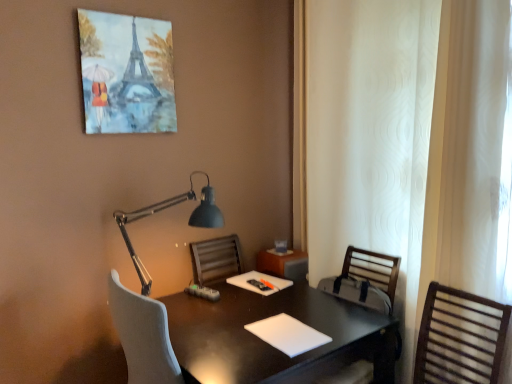
Question: Does black glossy desk at center have a greater height compared to white matte notepad at center, which is the first notepad from bottom to top?

Choices:
 (A) no
 (B) yes

Answer: (B)

Question: Can you confirm if black glossy desk at center is wider than white matte notepad at center, the first notepad positioned from the front?

Choices:
 (A) no
 (B) yes

Answer: (B)

Question: Is black glossy desk at center located outside white matte notepad at center, which is the second notepad in top-to-bottom order?

Choices:
 (A) yes
 (B) no

Answer: (A)

Question: From the image's perspective, is black glossy desk at center located beneath white matte notepad at center, positioned as the 2th notepad in back-to-front order?

Choices:
 (A) no
 (B) yes

Answer: (B)

Question: Does black glossy desk at center have a larger size compared to white matte notepad at center, the first notepad positioned from the front?

Choices:
 (A) no
 (B) yes

Answer: (B)

Question: Relative to white textured curtain at right, is matte black lamp at upper center in front or behind?

Choices:
 (A) behind
 (B) front

Answer: (A)

Question: Considering the relative positions of matte black lamp at upper center and white textured curtain at right in the image provided, is matte black lamp at upper center to the left or to the right of white textured curtain at right?

Choices:
 (A) left
 (B) right

Answer: (A)

Question: From the image's perspective, relative to white textured curtain at right, is matte black lamp at upper center above or below?

Choices:
 (A) below
 (B) above

Answer: (A)

Question: Looking at the image, does matte black lamp at upper center seem bigger or smaller compared to white textured curtain at right?

Choices:
 (A) big
 (B) small

Answer: (B)

Question: Is wooden slatted chair at right, placed as the second chair when sorted from front to back, taller or shorter than matte black lamp at upper center?

Choices:
 (A) short
 (B) tall

Answer: (B)

Question: From the image's perspective, relative to matte black lamp at upper center, is wooden slatted chair at right, placed as the second chair when sorted from front to back, above or below?

Choices:
 (A) below
 (B) above

Answer: (A)

Question: From a real-world perspective, is wooden slatted chair at right, the first chair from the back, positioned above or below matte black lamp at upper center?

Choices:
 (A) above
 (B) below

Answer: (B)

Question: Considering the positions of wooden slatted chair at right, placed as the second chair when sorted from front to back, and matte black lamp at upper center in the image, is wooden slatted chair at right, placed as the second chair when sorted from front to back, wider or thinner than matte black lamp at upper center?

Choices:
 (A) thin
 (B) wide

Answer: (B)

Question: From a real-world perspective, is black glossy desk at center physically located above or below white matte notepad at center, positioned as the 2th notepad in back-to-front order?

Choices:
 (A) below
 (B) above

Answer: (A)

Question: Is point (202, 312) positioned closer to the camera than point (311, 339)?

Choices:
 (A) farther
 (B) closer

Answer: (A)